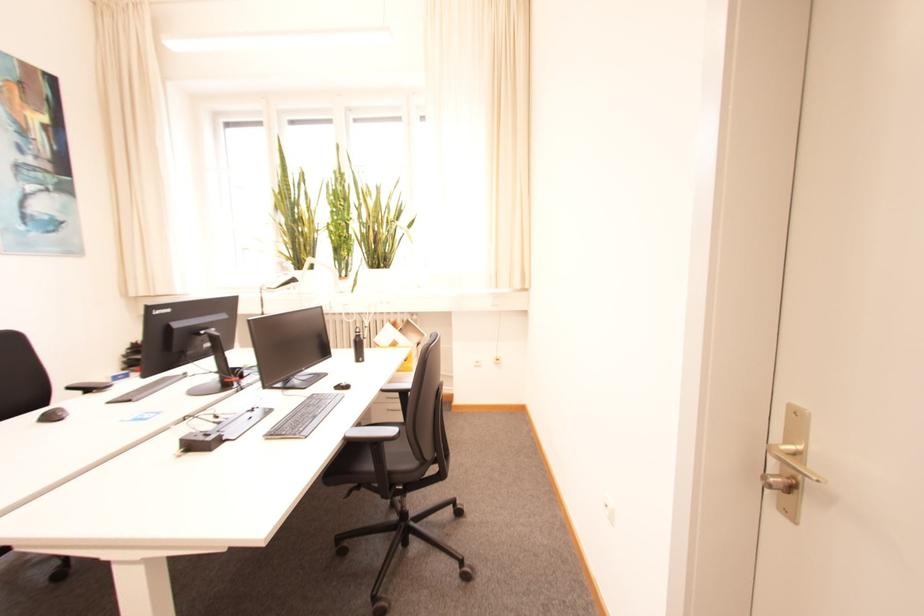
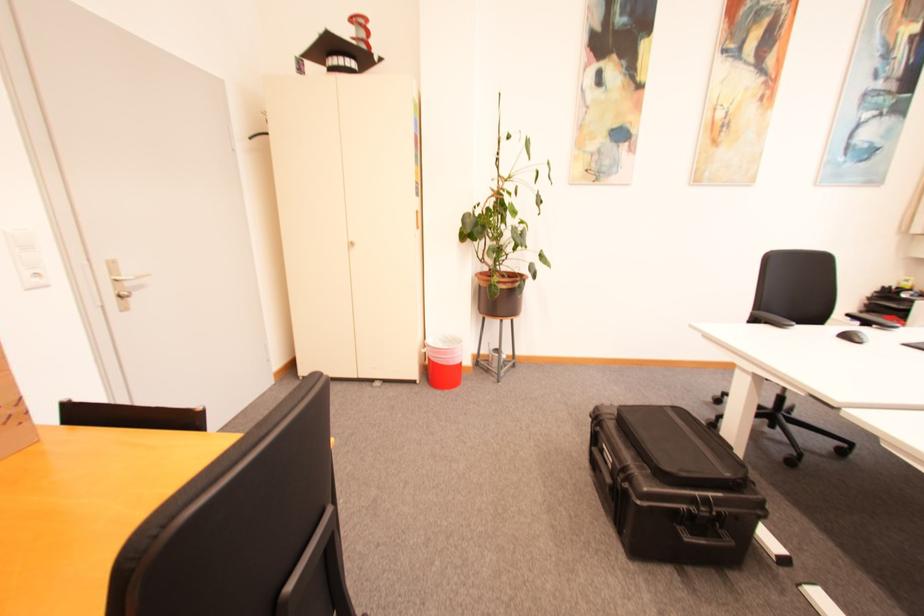
In the second image, find the point that corresponds to (x=64, y=419) in the first image.

(865, 342)